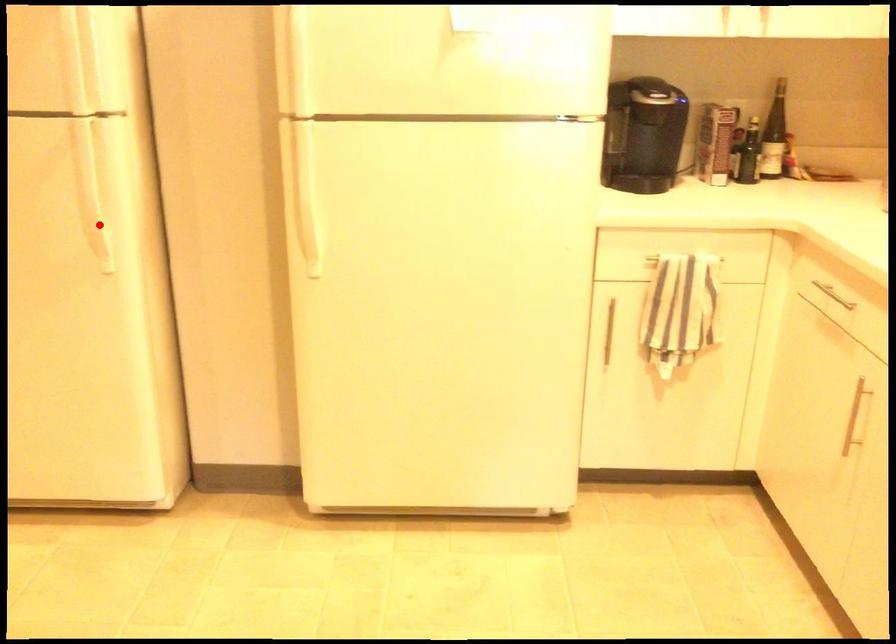
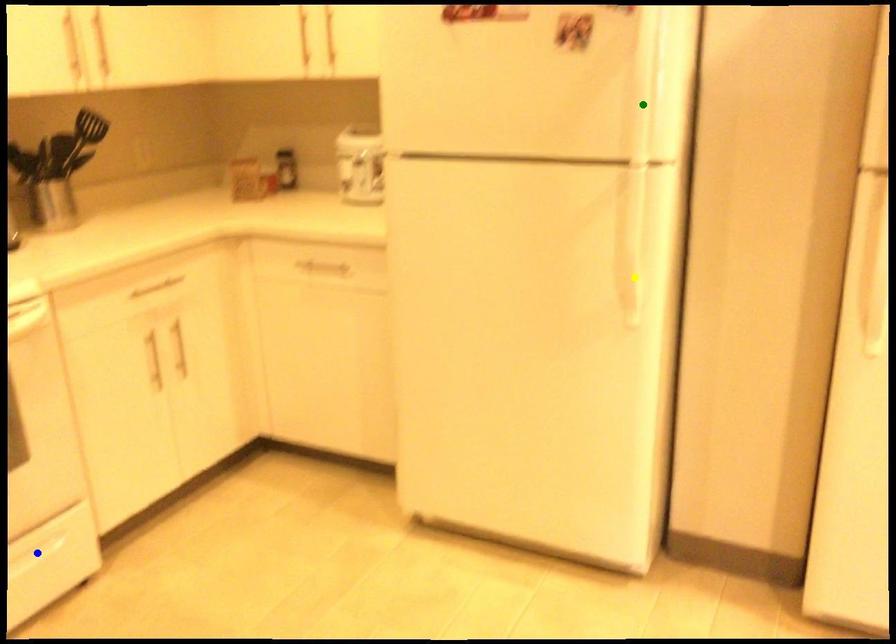
Question: I am providing you with two images of the same scene from different viewpoints. A red point is marked on the first image. You are given multiple points on the second image. Which point in image 2 is actually the same real-world point as the red point in image 1?

Choices:
 (A) green point
 (B) blue point
 (C) yellow point

Answer: (C)